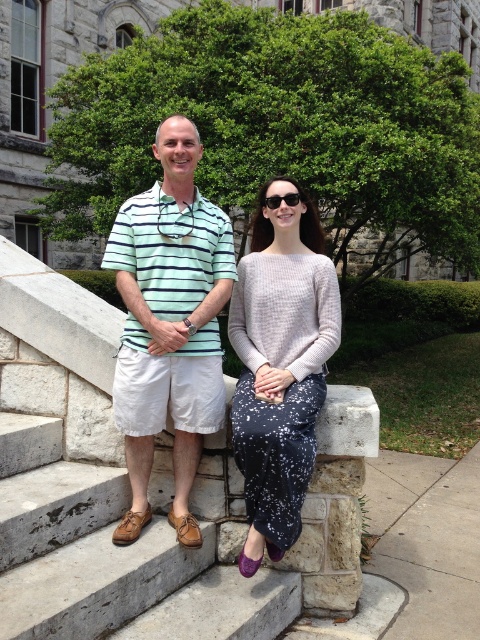
You are a photographer setting up a tripod between the brown leather shoe at lower left and the speckled fabric skirt at center. The tripod requires a minimum of 30 inches of space to set up. Can you set it up between these two objects?

The distance between the brown leather shoe at lower left and the speckled fabric skirt at center is 31.65 inches, which is more than the required 30 inches. Therefore, you can set up the tripod between them.

You are standing in front of the scene described. You want to find the brown leather shoe at lower left. According to the coordinates provided, which object in the scene is located at point (110,557)?

The point (110,557) marks the brown leather shoe at lower left.